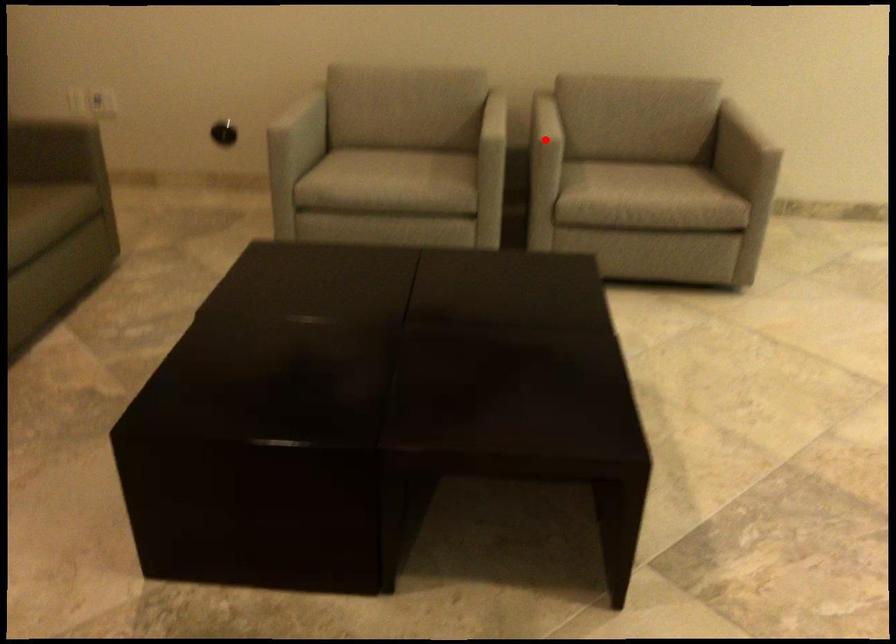
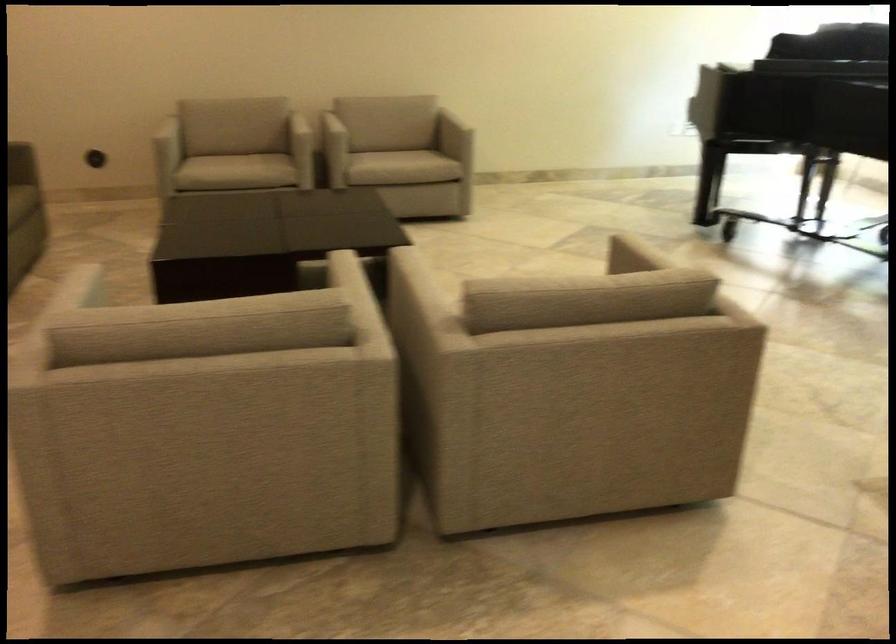
The point at the highlighted location is marked in the first image. Where is the corresponding point in the second image?

(337, 128)